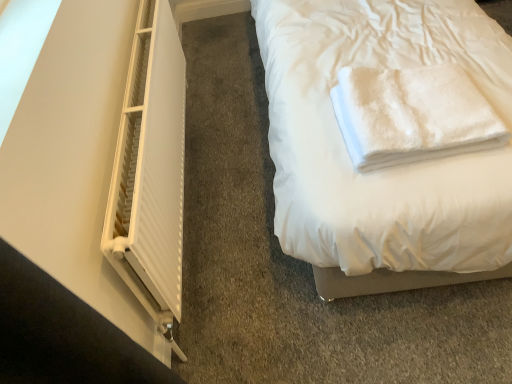
Question: Should I look upward or downward to see white matte radiator at left?

Choices:
 (A) down
 (B) up

Answer: (B)

Question: Does white fluffy towel at upper right have a smaller size compared to white matte radiator at left?

Choices:
 (A) yes
 (B) no

Answer: (A)

Question: From a real-world perspective, is white fluffy towel at upper right on white matte radiator at left?

Choices:
 (A) no
 (B) yes

Answer: (B)

Question: Considering the relative positions of white fluffy towel at upper right and white matte radiator at left in the image provided, is white fluffy towel at upper right to the right of white matte radiator at left from the viewer's perspective?

Choices:
 (A) no
 (B) yes

Answer: (B)

Question: Is white fluffy towel at upper right placed right next to white matte radiator at left?

Choices:
 (A) yes
 (B) no

Answer: (B)

Question: Is white fluffy towel at upper right outside white matte radiator at left?

Choices:
 (A) no
 (B) yes

Answer: (B)

Question: From the image's perspective, is white fluffy towel at upper right over white matte radiator at left?

Choices:
 (A) no
 (B) yes

Answer: (B)

Question: Is white matte radiator at left further to camera compared to white fluffy towel at upper right?

Choices:
 (A) no
 (B) yes

Answer: (A)

Question: Can you confirm if white matte radiator at left is wider than white fluffy towel at upper right?

Choices:
 (A) yes
 (B) no

Answer: (B)

Question: Is white matte radiator at left not within white fluffy towel at upper right?

Choices:
 (A) no
 (B) yes

Answer: (B)

Question: Is white matte radiator at left taller than white fluffy towel at upper right?

Choices:
 (A) yes
 (B) no

Answer: (A)

Question: From a real-world perspective, is white matte radiator at left over white fluffy towel at upper right?

Choices:
 (A) no
 (B) yes

Answer: (A)

Question: Is white matte radiator at left smaller than white fluffy towel at upper right?

Choices:
 (A) no
 (B) yes

Answer: (A)

Question: From a real-world perspective, relative to white fluffy towel at upper right, is white matte radiator at left vertically above or below?

Choices:
 (A) above
 (B) below

Answer: (B)